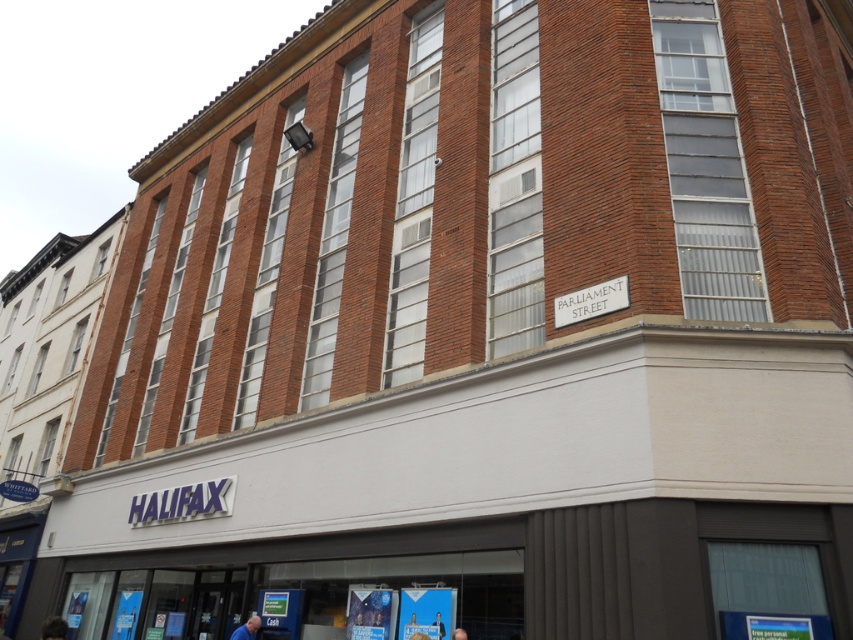
You are a delivery person standing at the entrance of the Halifax bank. You see a blue fabric at lower center and a blue fabric person at lower center. Which one is closer to you?

The blue fabric at lower center is closer to you because the blue fabric person at lower center is behind it.

You are a customer standing outside the Halifax bank on Parliament Street. You see a person with brown hair at lower left and a blue fabric person at lower center. Which of these two figures appears bigger in size?

The brown hair at lower left appears bigger in size compared to the blue fabric person at lower center.